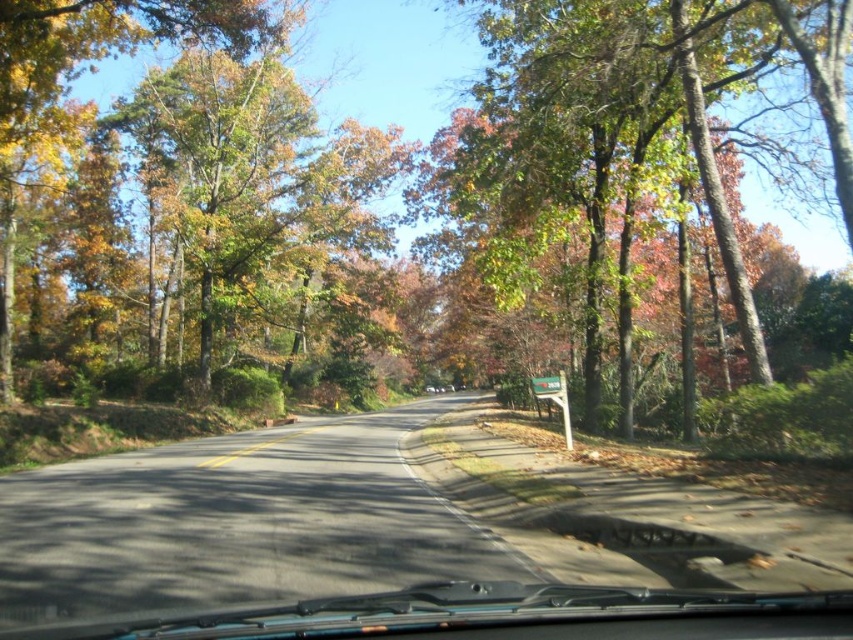
Between point (502, 237) and point (550, 392), which one is positioned behind?

The point (502, 237) is behind.

What do you see at coordinates (628, 124) in the screenshot? I see `green leafy tree at center` at bounding box center [628, 124].

Between point (561, 29) and point (564, 412), which one is positioned behind?

Positioned behind is point (561, 29).

Find the location of a particular element. Image resolution: width=853 pixels, height=640 pixels. green leafy tree at center is located at coordinates (628, 124).

Is transparent rubber windshield wipers at lower center below green plastic sign at center?

Yes.

Does transparent rubber windshield wipers at lower center have a greater width compared to green plastic sign at center?

Answer: Yes, transparent rubber windshield wipers at lower center is wider than green plastic sign at center.

Is point (822, 596) behind point (567, 420)?

No, (822, 596) is closer to viewer.

This screenshot has height=640, width=853. What are the coordinates of `transparent rubber windshield wipers at lower center` in the screenshot? It's located at (463, 612).

Does green leafy tree at center appear under transparent rubber windshield wipers at lower center?

No.

Is point (479, 173) positioned behind point (461, 620)?

That is True.

Consider the image. Who is more distant from viewer, (517, 72) or (338, 630)?

Point (517, 72)

This screenshot has height=640, width=853. I want to click on green leafy tree at center, so click(628, 124).